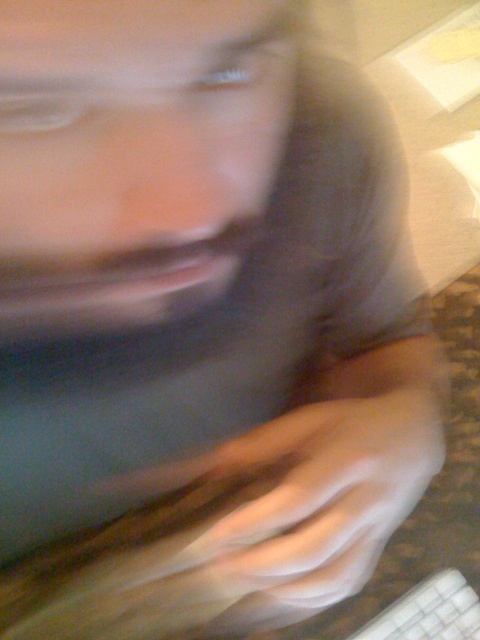
Question: Which point is closer to the camera?

Choices:
 (A) smooth skin hand at center
 (B) white plastic keyboard at lower right

Answer: (A)

Question: Among these objects, which one is farthest from the camera?

Choices:
 (A) smooth skin hand at center
 (B) white plastic keyboard at lower right

Answer: (B)

Question: Can you confirm if smooth skin hand at center is wider than white plastic keyboard at lower right?

Choices:
 (A) yes
 (B) no

Answer: (A)

Question: Does smooth skin hand at center appear on the left side of white plastic keyboard at lower right?

Choices:
 (A) no
 (B) yes

Answer: (B)

Question: Does smooth skin hand at center appear on the left side of white plastic keyboard at lower right?

Choices:
 (A) no
 (B) yes

Answer: (B)

Question: Which object appears farthest from the camera in this image?

Choices:
 (A) white plastic keyboard at lower right
 (B) smooth skin hand at center

Answer: (A)